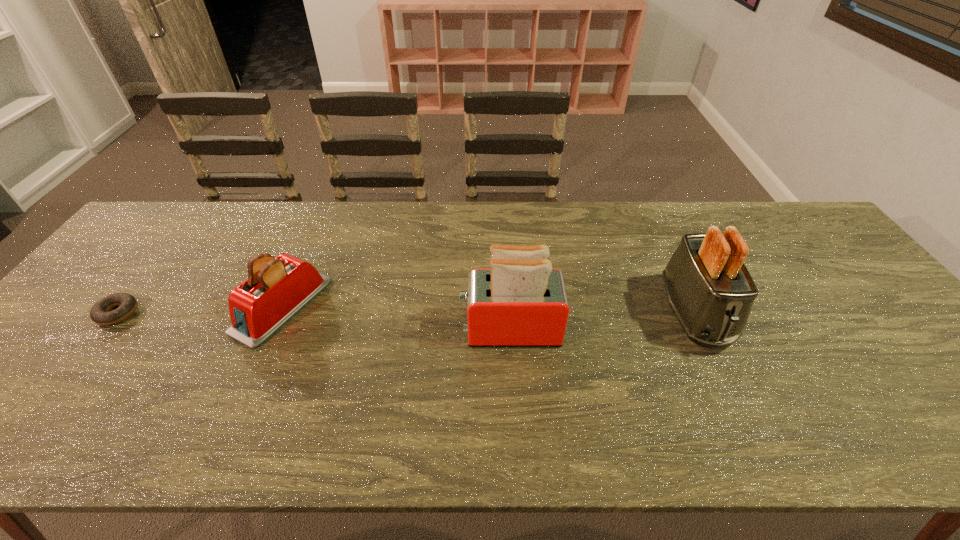
At what (x,y) coordinates should I click in order to perform the action: click on free spot between the second toaster from right to left and the third object from right to left. Please return your answer as a coordinate pair (x, y). The width and height of the screenshot is (960, 540). Looking at the image, I should click on (396, 318).

Image resolution: width=960 pixels, height=540 pixels. I want to click on free space between the doughnut and the second object from right to left, so click(314, 321).

Identify the location of free space that is in between the second shortest object and the second toaster from right to left. Image resolution: width=960 pixels, height=540 pixels. (396, 318).

You are a GUI agent. You are given a task and a screenshot of the screen. Output one action in this format:
    pyautogui.click(x=<x>, y=<y>)
    Task: Click on the blank region between the second toaster from left to right and the rightmost toaster
    
    Given the screenshot: What is the action you would take?
    pyautogui.click(x=602, y=321)

The width and height of the screenshot is (960, 540). Find the location of `free spot between the leftmost object and the rightmost toaster`. free spot between the leftmost object and the rightmost toaster is located at coordinates (406, 313).

Locate which object ranks second in proximity to the second object from right to left. Please provide its 2D coordinates. Your answer should be formatted as a tuple, i.e. [(x, y)], where the tuple contains the x and y coordinates of a point satisfying the conditions above.

[(277, 288)]

Select which object is the second closest to the leftmost object. Please provide its 2D coordinates. Your answer should be formatted as a tuple, i.e. [(x, y)], where the tuple contains the x and y coordinates of a point satisfying the conditions above.

[(521, 301)]

Where is `toaster that stands as the closest to the rightmost toaster`? This screenshot has width=960, height=540. toaster that stands as the closest to the rightmost toaster is located at coordinates (521, 301).

Locate which toaster is the second closest to the third tallest object. Please provide its 2D coordinates. Your answer should be formatted as a tuple, i.e. [(x, y)], where the tuple contains the x and y coordinates of a point satisfying the conditions above.

[(711, 292)]

I want to click on free space that satisfies the following two spatial constraints: 1. on the side of the rightmost object with the control lever; 2. on the front-facing side of the second toaster from left to right, so tap(702, 329).